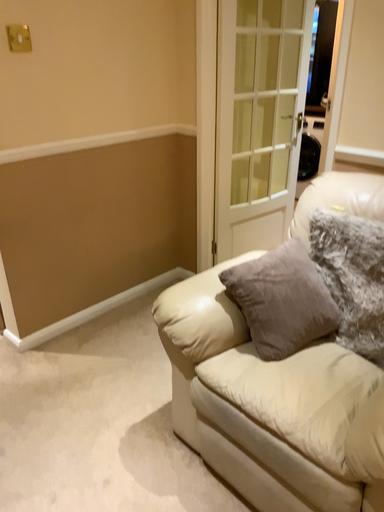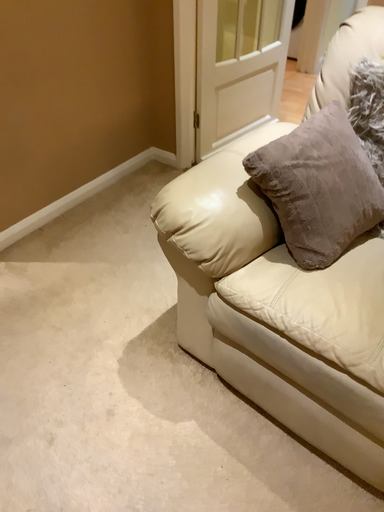
Question: How did the camera likely rotate when shooting the video?

Choices:
 (A) rotated right
 (B) rotated left

Answer: (A)